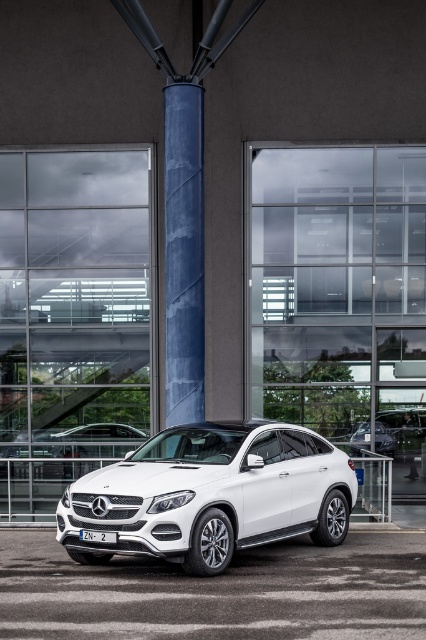
From the picture: You are standing in front of the white Mercedes GLE Class parked at an angle. You notice the white glossy parking lot at center and the blue textured column at center. Which object is nearer to you?

The white glossy parking lot at center is closer to the viewer than the blue textured column at center.

You are a photographer planning to capture the white metallic car at center and the blue textured column at center in a single shot. Based on their positions, will the car be visible behind the column or in front of it?

The white metallic car at center is below the blue textured column at center, so the car will be positioned in front of the column in the photograph.